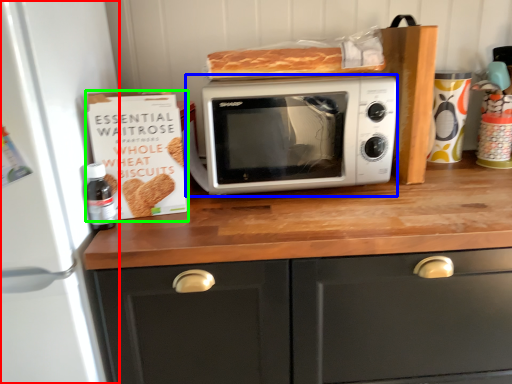
Question: Which object is positioned farthest from appliance (highlighted by a red box)? Select from microwave oven (highlighted by a blue box) and cardboard box (highlighted by a green box).

Choices:
 (A) microwave oven
 (B) cardboard box

Answer: (A)